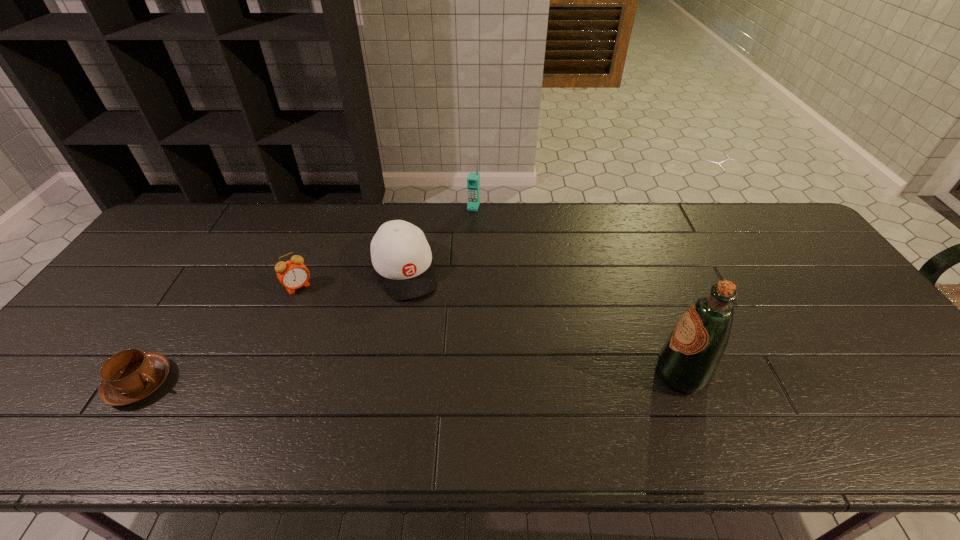
Find the location of a particular element. The height and width of the screenshot is (540, 960). cappuccino is located at coordinates (129, 376).

Locate an element on the screen. the shortest object is located at coordinates (129, 376).

Find the location of a particular element. This screenshot has height=540, width=960. the tallest object is located at coordinates (687, 362).

In order to click on olive oil in this screenshot , I will do `click(687, 362)`.

I want to click on the second object from left to right, so click(293, 274).

Where is `the third object from left to right`? This screenshot has height=540, width=960. the third object from left to right is located at coordinates (400, 253).

I want to click on the farthest object, so click(473, 181).

Identify the location of the fourth shortest object. (473, 181).

This screenshot has height=540, width=960. Find the location of `free location located on the side of the shortest object with the handle`. free location located on the side of the shortest object with the handle is located at coordinates (340, 383).

Locate an element on the screen. Image resolution: width=960 pixels, height=540 pixels. vacant space located 0.180m on the front-facing side of the rightmost object is located at coordinates (579, 375).